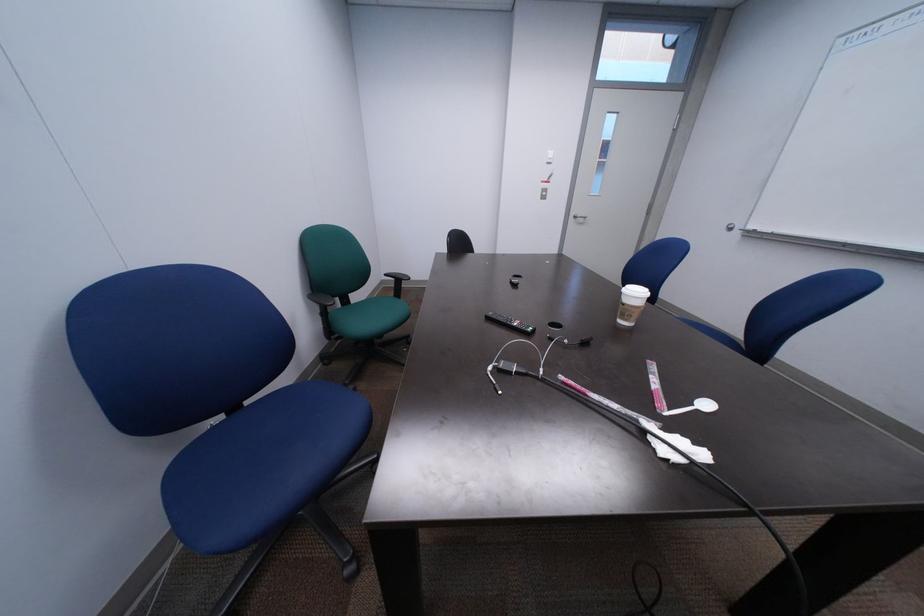
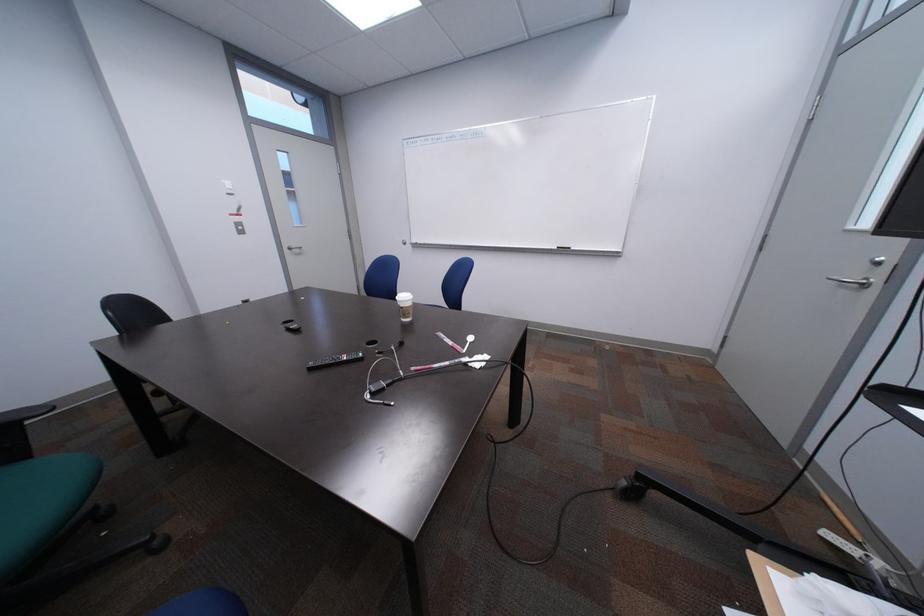
Question: How did the camera likely rotate?

Choices:
 (A) Left
 (B) Right
 (C) Up
 (D) Down

Answer: (B)